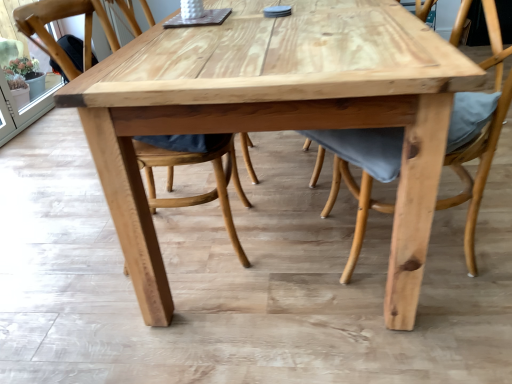
Image resolution: width=512 pixels, height=384 pixels. I want to click on free location in front of natural wood chair at center, the 1th chair from the left, so click(169, 325).